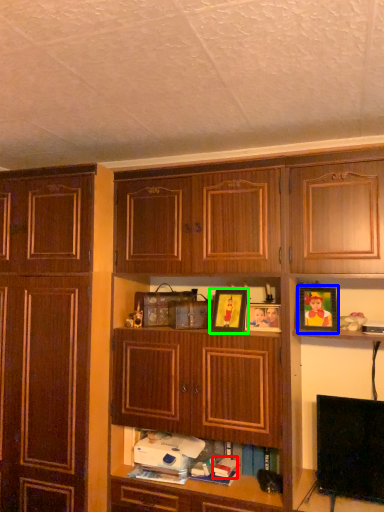
Question: Which object is positioned farthest from book (highlighted by a red box)? Select from picture frame (highlighted by a blue box) and picture frame (highlighted by a green box).

Choices:
 (A) picture frame
 (B) picture frame

Answer: (A)